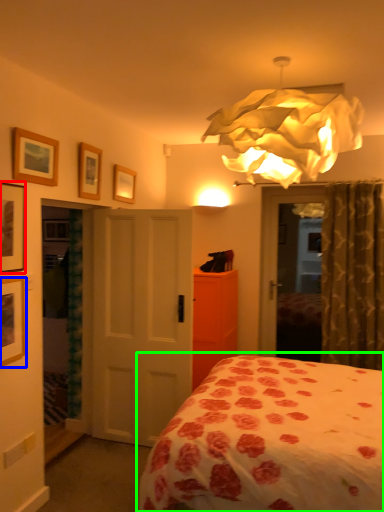
Question: Considering the real-world distances, which object is farthest from picture frame (highlighted by a red box)? picture frame (highlighted by a blue box) or bed (highlighted by a green box)?

Choices:
 (A) picture frame
 (B) bed

Answer: (B)